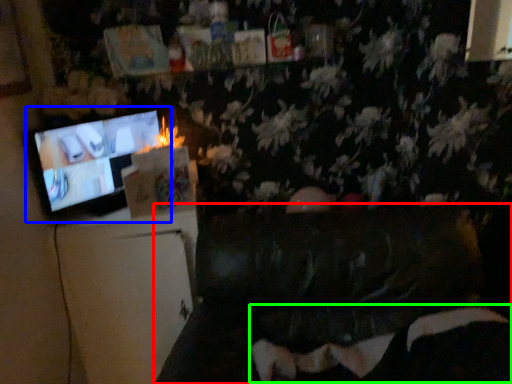
Question: Which object is the farthest from furniture (highlighted by a red box)? Choose among these: television (highlighted by a blue box) or bean bag chair (highlighted by a green box).

Choices:
 (A) television
 (B) bean bag chair

Answer: (A)